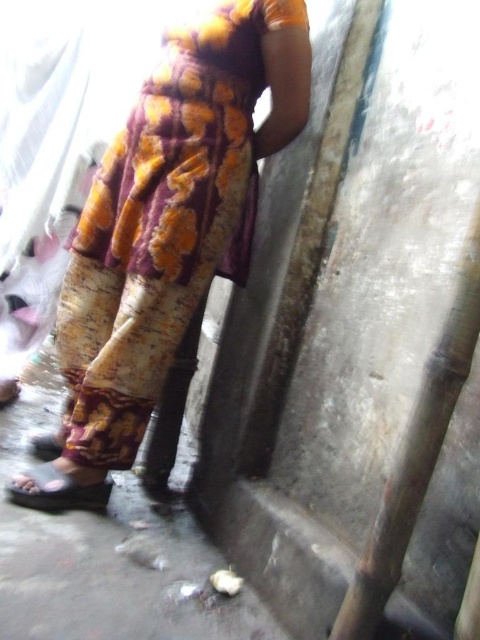
You are standing at point (x=55, y=464) and want to walk to the exit located at point (x=291, y=3). Is the exit directly in front of you or behind you?

The exit at point (x=291, y=3) is in front of you because it is positioned in front of point (x=55, y=464) where you are standing.

You are a photographer setting up a shoot in this indoor space. You need to ensure that the printed fabric dress at center is visible in the frame without being blocked by the matte black sandal at lower left. Based on their positions, will the dress be visible?

The printed fabric dress at center is in front of the matte black sandal at lower left, so the dress will be visible and not blocked by the sandal.